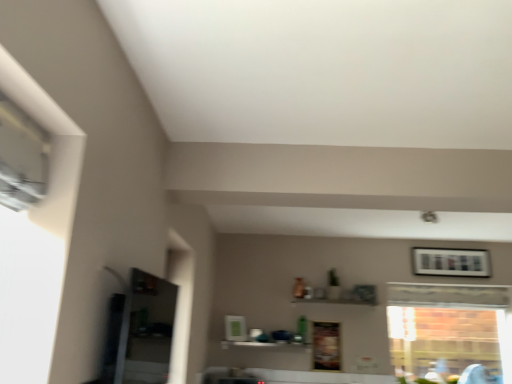
What do you see at coordinates (262, 344) in the screenshot? I see `white glossy shelf at center` at bounding box center [262, 344].

The image size is (512, 384). What do you see at coordinates (451, 262) in the screenshot?
I see `wooden framed picture at upper right` at bounding box center [451, 262].

At what (x,y) coordinates should I click in order to perform the action: click on white glossy shelf at center. Please return your answer as a coordinate pair (x, y). The image size is (512, 384). Looking at the image, I should click on (262, 344).

Is clear glass window at right bigger or smaller than wooden framed picture at upper right?

clear glass window at right is bigger than wooden framed picture at upper right.

Between clear glass window at right and wooden framed picture at upper right, which one is positioned behind?

Positioned behind is wooden framed picture at upper right.

In the image, is clear glass window at right on the left side or the right side of wooden framed picture at upper right?

In the image, clear glass window at right appears on the left side of wooden framed picture at upper right.

Is clear glass window at right turned away from wooden framed picture at upper right?

No, clear glass window at right's orientation is not away from wooden framed picture at upper right.

Which is more to the right, wooden framed picture at upper right or clear glass window at right?

Positioned to the right is wooden framed picture at upper right.

Considering the points (486, 257) and (446, 321), which point is behind, point (486, 257) or point (446, 321)?

The point (446, 321) is farther.

Considering the positions of objects wooden framed picture at upper right and clear glass window at right in the image provided, who is in front, wooden framed picture at upper right or clear glass window at right?

Positioned in front is clear glass window at right.

Looking at this image, from a real-world perspective, is wooden framed picture at upper right on top of clear glass window at right?

Yes, from a real-world perspective, wooden framed picture at upper right is above clear glass window at right.

Considering the positions of objects white glossy shelf at center and wooden framed picture at upper right in the image provided, who is more to the right, white glossy shelf at center or wooden framed picture at upper right?

Positioned to the right is wooden framed picture at upper right.

Is white glossy shelf at center oriented towards wooden framed picture at upper right?

No, white glossy shelf at center is not oriented towards wooden framed picture at upper right.

Is white glossy shelf at center placed right next to wooden framed picture at upper right?

No, white glossy shelf at center is not beside wooden framed picture at upper right.

Considering the sizes of objects white glossy shelf at center and wooden framed picture at upper right in the image provided, who is thinner, white glossy shelf at center or wooden framed picture at upper right?

wooden framed picture at upper right is thinner.

How many degrees apart are the facing directions of white glossy shelf at center and clear glass window at right?

They differ by 0.0752 degrees in their facing directions.

Which is nearer, (294,344) or (471,308)?

Point (294,344) is closer to the camera than point (471,308).

Are white glossy shelf at center and clear glass window at right far apart?

Yes, white glossy shelf at center is far from clear glass window at right.

Is clear glass window at right bigger or smaller than white glossy shelf at center?

In the image, clear glass window at right appears to be larger than white glossy shelf at center.

From the image's perspective, is clear glass window at right under white glossy shelf at center?

Incorrect, from the image's perspective, clear glass window at right is higher than white glossy shelf at center.

Is clear glass window at right situated inside white glossy shelf at center or outside?

clear glass window at right lies outside white glossy shelf at center.

Between clear glass window at right and white glossy shelf at center, which one has less height?

white glossy shelf at center.

From a real-world perspective, is wooden framed picture at upper right beneath white glossy shelf at center?

No, from a real-world perspective, wooden framed picture at upper right is not below white glossy shelf at center.

Is wooden framed picture at upper right positioned far away from white glossy shelf at center?

Absolutely, wooden framed picture at upper right is distant from white glossy shelf at center.

Which is in front, point (415, 267) or point (279, 345)?

Point (279, 345)

Find the location of a particular element. The height and width of the screenshot is (384, 512). window below the wooden framed picture at upper right (from the image's perspective) is located at coordinates (449, 330).

Where is `picture frame that appears on the right of clear glass window at right`? Image resolution: width=512 pixels, height=384 pixels. picture frame that appears on the right of clear glass window at right is located at coordinates (451, 262).

From the image, which object appears to be nearer to wooden framed picture at upper right, clear glass window at right or white glossy shelf at center?

clear glass window at right.

In the scene shown: Considering their positions, is white glossy shelf at center positioned closer to clear glass window at right than wooden framed picture at upper right?

The object closer to clear glass window at right is wooden framed picture at upper right.

Considering their positions, is white glossy shelf at center positioned closer to wooden framed picture at upper right than clear glass window at right?

clear glass window at right lies closer to wooden framed picture at upper right than the other object.

Based on their spatial positions, is wooden framed picture at upper right or white glossy shelf at center closer to clear glass window at right?

wooden framed picture at upper right is positioned closer to the anchor clear glass window at right.

Considering their positions, is wooden framed picture at upper right positioned further to white glossy shelf at center than clear glass window at right?

clear glass window at right.

Looking at the image, which one is located further to white glossy shelf at center, clear glass window at right or wooden framed picture at upper right?

clear glass window at right.

Find the location of a particular element. window situated between white glossy shelf at center and wooden framed picture at upper right from left to right is located at coordinates click(x=449, y=330).